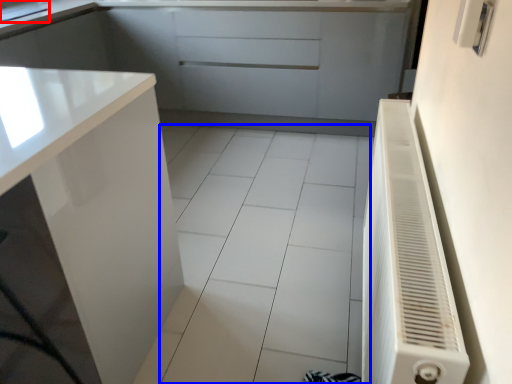
Question: Which of the following is the closest to the observer, sink (highlighted by a red box) or ceramic tile (highlighted by a blue box)?

Choices:
 (A) sink
 (B) ceramic tile

Answer: (B)